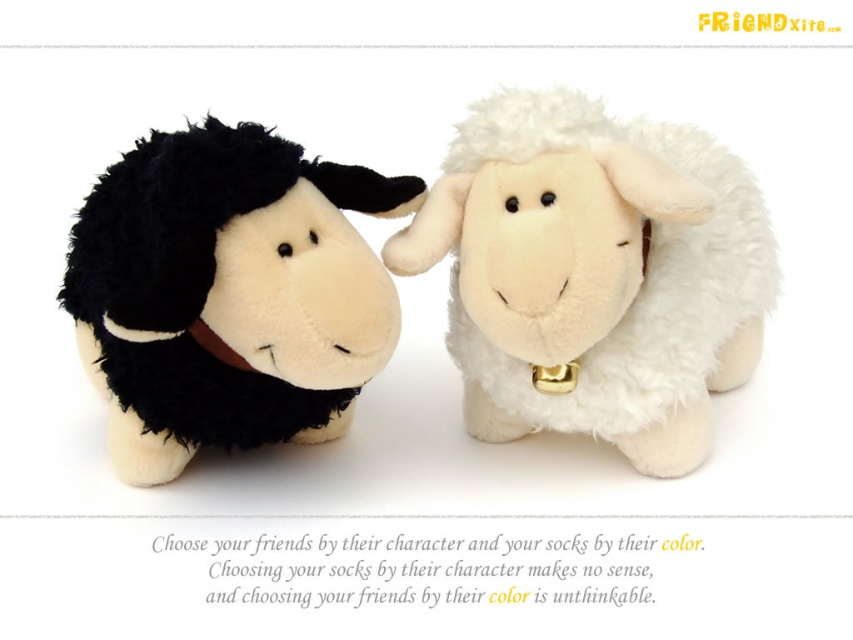
You are organizing a toy store shelf and need to place the white plush sheep at center and the black plush sheep at left in a way that follows the store policy of arranging items from tallest to shortest. Which sheep should be placed first on the shelf?

The black plush sheep at left should be placed first because the white plush sheep at center is positioned over it, indicating it is taller and should be placed after the shorter one to follow the tallest to shortest arrangement.

You are organizing a toy store shelf and need to place the white plush sheep at center and the brown fabric neckband at left. Since the neckband is smaller, where should you place it relative to the sheep?

The white plush sheep at center is larger than the brown fabric neckband at left, so you should place the brown fabric neckband at left next to or below the white plush sheep at center to maintain visual balance.

You are holding a camera and want to take a photo of the two sheep toys. The camera is currently at a position that is 37.29 inches away from the point labeled as point (103, 316). If you need to ensure that both sheep toys are fully visible in the frame, should you move the camera closer or farther away?

The camera is currently 37.29 inches away from point (103, 316). To ensure both sheep toys are fully visible in the frame, you should move the camera farther away. Moving closer might cause some parts of the sheep toys to be cut off, while moving farther away would allow the entire scene to fit within the camera frame.